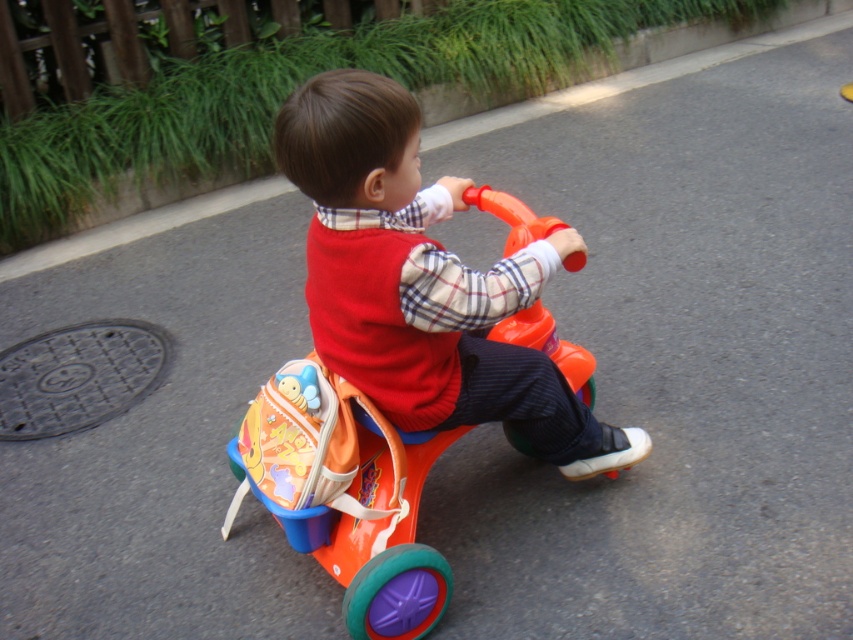
You are a photographer standing at the edge of the road. You want to take a photo of the matte orange plastic tricycle at center. If your camera can focus on objects within 1 meter, will it be able to focus on the tricycle?

The matte orange plastic tricycle at center is 1.03 meters away from the camera. Since the camera can focus on objects within 1 meter, it will not be able to focus on the tricycle because it is slightly beyond the 1 meter range.

You are standing on the road and want to place two markers at the exact positions of point (392, 385) and point (416, 436). Which marker will be closer to you when placed?

Point (392, 385) is closer to the viewer than point (416, 436), so the marker at point (392, 385) will be closer to you.